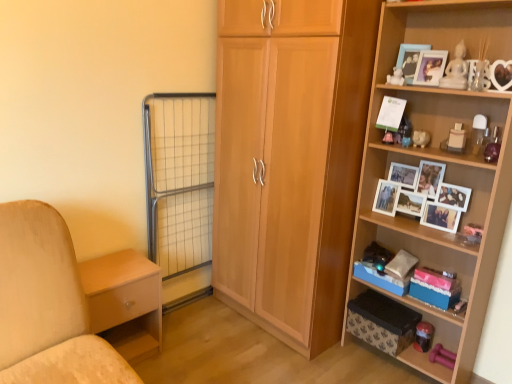
Locate an element on the screen. free space between light brown wood cupboard at center and metal grid screen door at lower left is located at coordinates click(x=219, y=329).